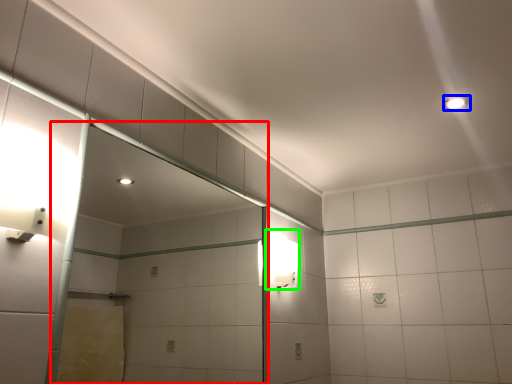
Question: Estimate the real-world distances between objects in this image. Which object is closer to glass door (highlighted by a red box), light fixture (highlighted by a blue box) or light fixture (highlighted by a green box)?

Choices:
 (A) light fixture
 (B) light fixture

Answer: (B)